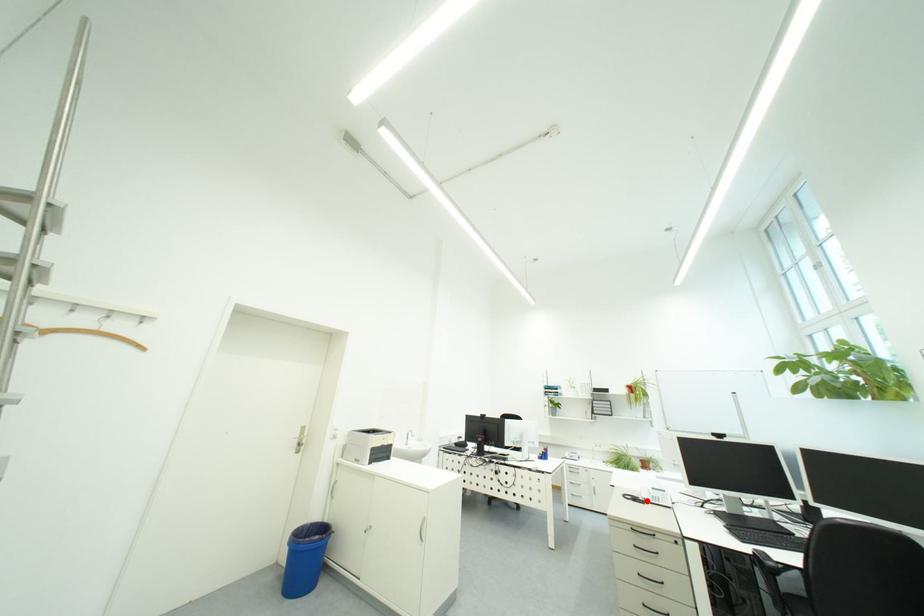
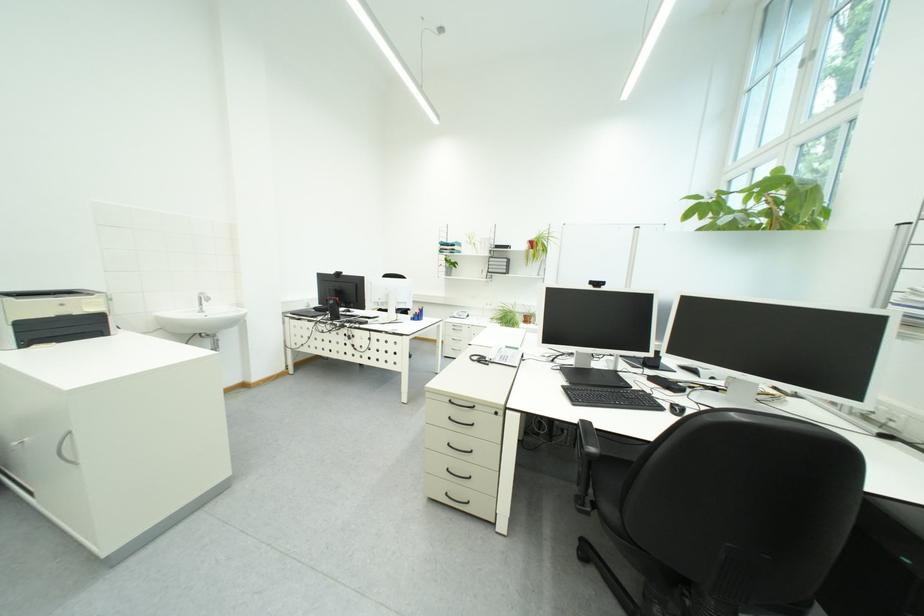
Find the pixel in the second image that matches the highlighted location in the first image.

(492, 362)